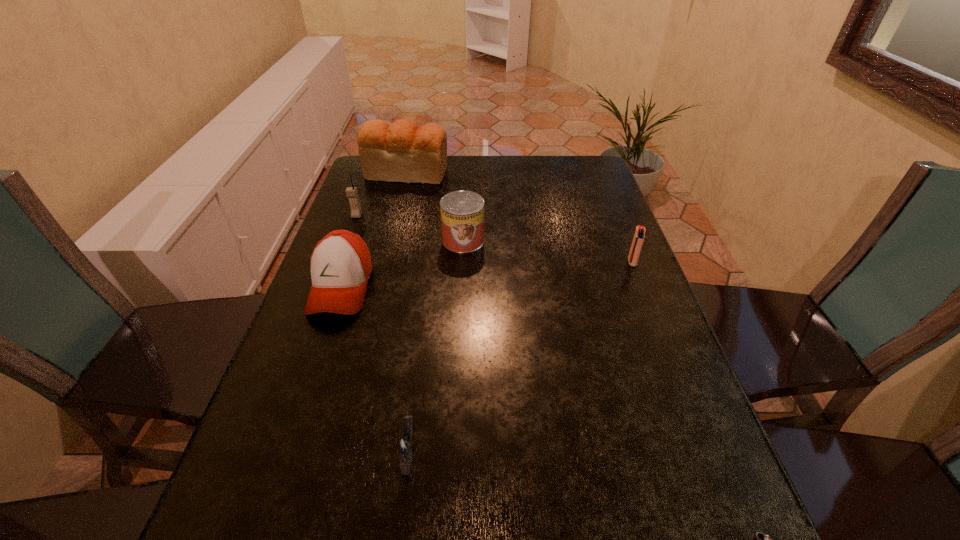
Locate an element on the screen. object present at the far left corner is located at coordinates (400, 152).

The width and height of the screenshot is (960, 540). In the image, there is a desktop. Identify the location of free region at the far edge. (527, 168).

This screenshot has width=960, height=540. Find the location of `free space at the left edge of the desktop`. free space at the left edge of the desktop is located at coordinates (368, 299).

The height and width of the screenshot is (540, 960). In the image, there is a desktop. In order to click on free region at the right edge in this screenshot , I will do `click(657, 403)`.

What are the coordinates of `free point at the far right corner` in the screenshot? It's located at (580, 174).

Locate an element on the screen. The width and height of the screenshot is (960, 540). empty space that is in between the can and the sixth farthest object is located at coordinates (436, 346).

This screenshot has height=540, width=960. I want to click on free space between the leftmost igniter and the sixth nearest object, so click(383, 334).

You are a GUI agent. You are given a task and a screenshot of the screen. Output one action in this format:
    pyautogui.click(x=<x>, y=<y>)
    Task: Click on the unoccupied area between the can and the second nearest igniter
    
    Given the screenshot: What is the action you would take?
    pyautogui.click(x=436, y=346)

At what (x,y) coordinates should I click in order to perform the action: click on free area in between the cellular telephone and the tallest igniter. Please return your answer as a coordinate pair (x, y). Image resolution: width=960 pixels, height=540 pixels. Looking at the image, I should click on (494, 239).

Identify the location of free point between the second farthest object and the farthest object. (382, 194).